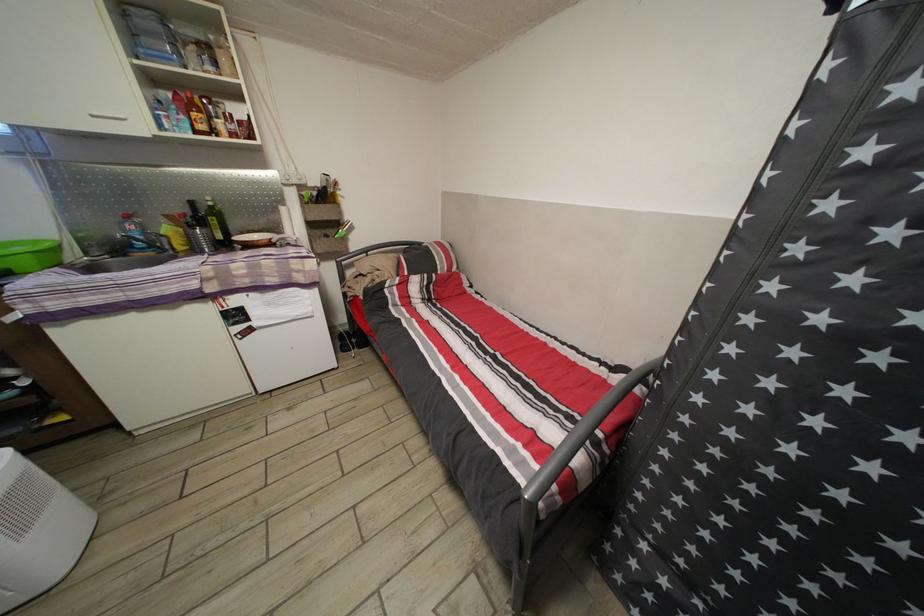
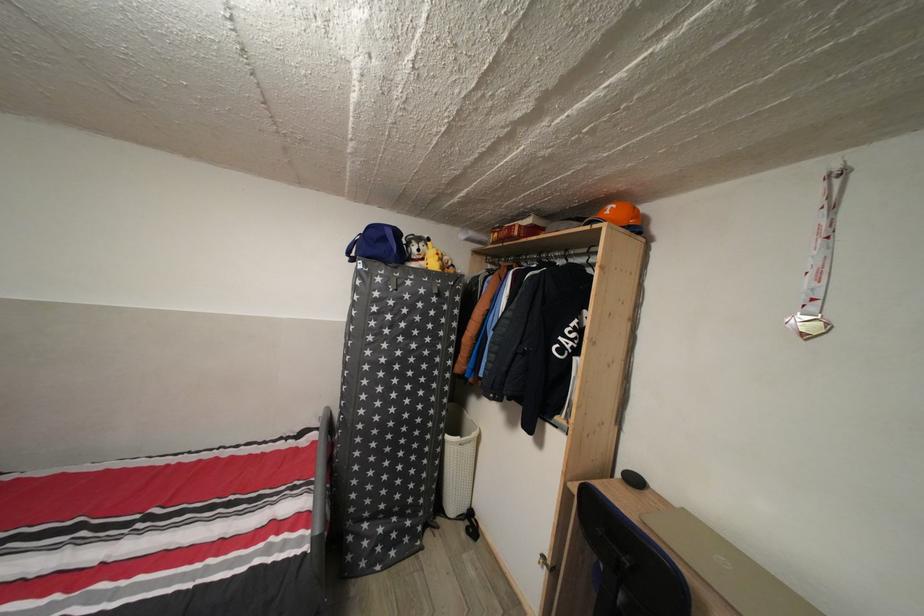
Question: The camera is either moving clockwise (left) or counter-clockwise (right) around the object. The first image is from the beginning of the video and the second image is from the end. Is the camera moving left or right when shooting the video?

Choices:
 (A) Left
 (B) Right

Answer: (A)